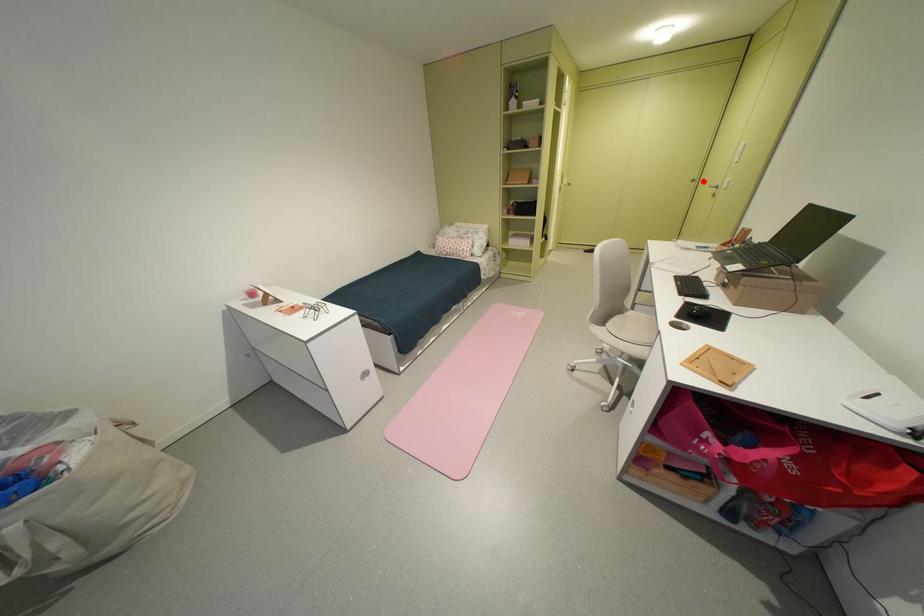
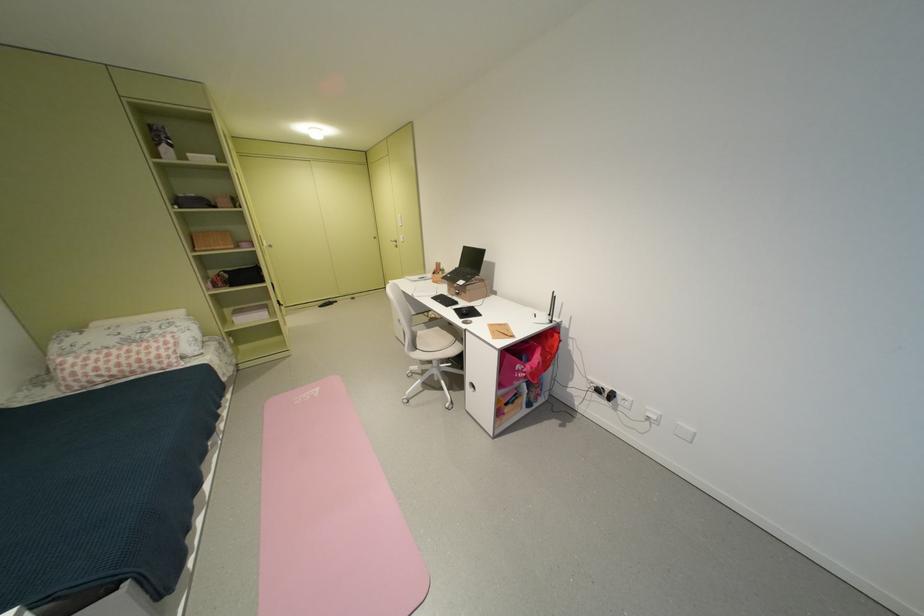
Locate, in the second image, the point that corresponds to the highlighted location in the first image.

(383, 238)